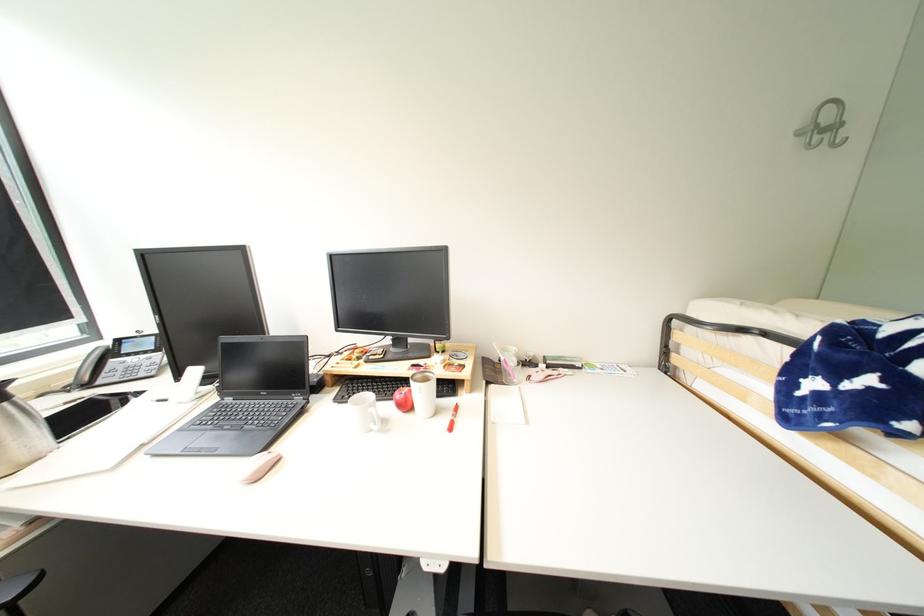
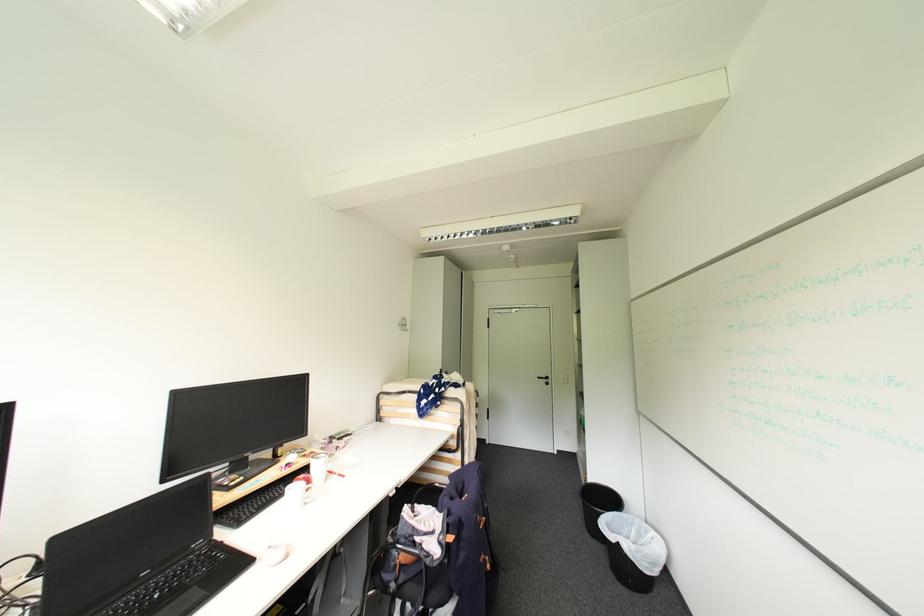
Where in the second image is the point corresponding to [270,394] from the first image?

(150, 575)